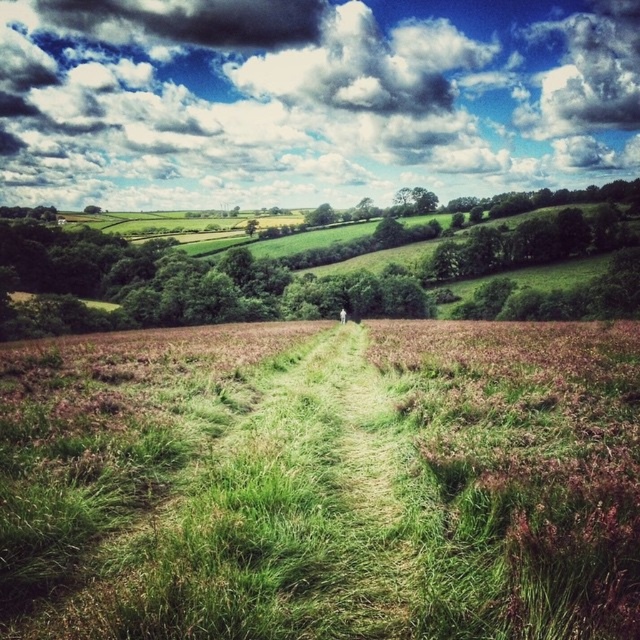
Who is higher up, green grassy path at center or white fluffy cloud at upper center?

white fluffy cloud at upper center is above.

Who is more forward, [244,580] or [433,80]?

Point [244,580] is in front.

Does point (515, 476) come behind point (449, 22)?

No, (515, 476) is closer to viewer.

Locate an element on the screen. This screenshot has width=640, height=640. green grassy path at center is located at coordinates (323, 483).

Is cloudy sky at upper center positioned in front of white fluffy cloud at upper center?

Yes, cloudy sky at upper center is closer to the viewer.

Who is positioned more to the right, cloudy sky at upper center or white fluffy cloud at upper center?

white fluffy cloud at upper center

Measure the distance between point (x=458, y=100) and camera.

Point (x=458, y=100) and camera are 390.42 meters apart from each other.

At what (x,y) coordinates should I click in order to perform the action: click on cloudy sky at upper center. Please return your answer as a coordinate pair (x, y). Looking at the image, I should click on (310, 97).

Is white fluffy cloud at upper center below white fabric person at center?

No, white fluffy cloud at upper center is not below white fabric person at center.

Does white fluffy cloud at upper center appear on the right side of white fabric person at center?

Indeed, white fluffy cloud at upper center is positioned on the right side of white fabric person at center.

The image size is (640, 640). I want to click on white fluffy cloud at upper center, so coord(365,65).

You are a GUI agent. You are given a task and a screenshot of the screen. Output one action in this format:
    pyautogui.click(x=<x>, y=<y>)
    Task: Click on the white fluffy cloud at upper center
    
    Given the screenshot: What is the action you would take?
    pyautogui.click(x=365, y=65)